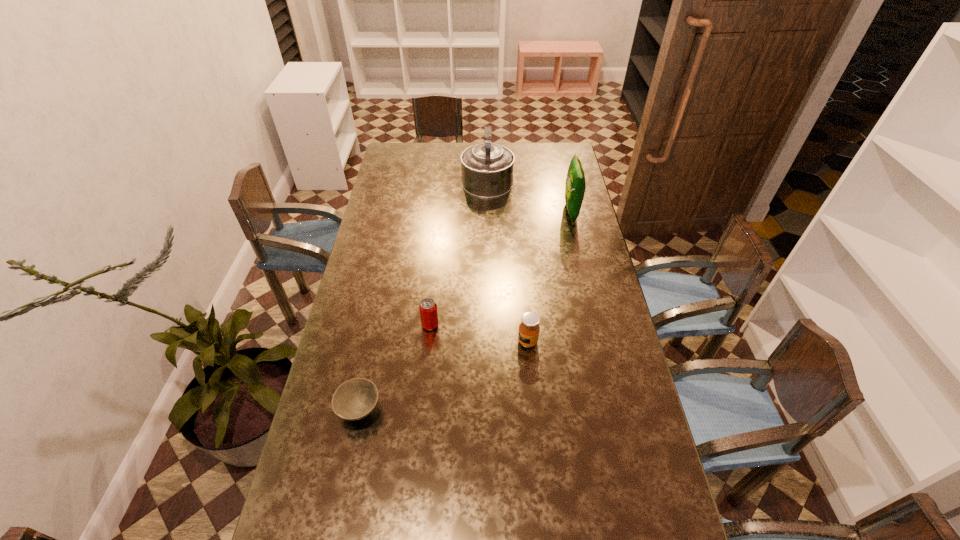
Where is `object located at the left edge`? The width and height of the screenshot is (960, 540). object located at the left edge is located at coordinates (355, 399).

Where is `object that is at the right edge`? This screenshot has width=960, height=540. object that is at the right edge is located at coordinates (x=575, y=186).

This screenshot has height=540, width=960. Find the location of `vacant position at the far edge of the desktop`. vacant position at the far edge of the desktop is located at coordinates (437, 158).

Where is `free space at the left edge`? free space at the left edge is located at coordinates (371, 303).

This screenshot has height=540, width=960. In the image, there is a desktop. What are the coordinates of `free space at the right edge` in the screenshot? It's located at (557, 187).

This screenshot has height=540, width=960. I want to click on blank space at the far left corner of the desktop, so pos(416,153).

Locate an element on the screen. The height and width of the screenshot is (540, 960). free space at the far right corner is located at coordinates (551, 162).

This screenshot has width=960, height=540. I want to click on vacant space in between the farthest object and the can, so click(x=459, y=252).

Where is `unoccupied area between the can and the farthest object`? unoccupied area between the can and the farthest object is located at coordinates (459, 252).

The height and width of the screenshot is (540, 960). I want to click on blank region between the bowl and the fourth nearest object, so pos(466,311).